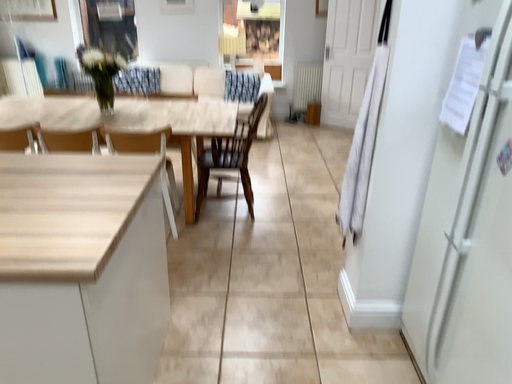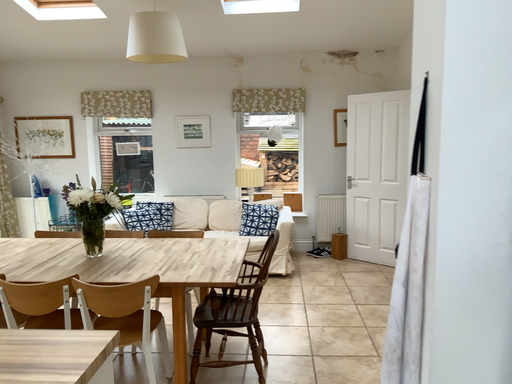
Question: Which way did the camera rotate in the video?

Choices:
 (A) rotated downward
 (B) rotated upward

Answer: (B)